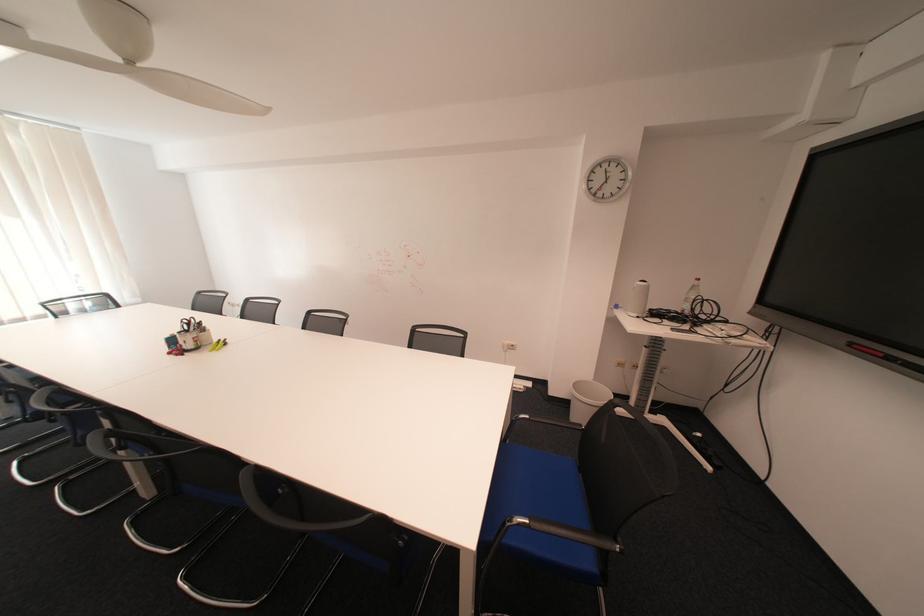
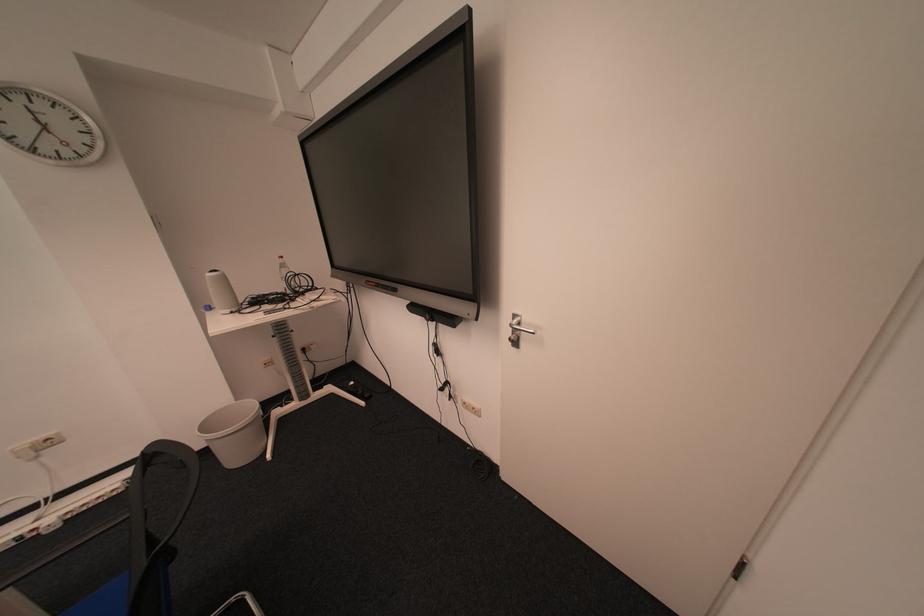
In the second image, find the point that corresponds to the point at 588,387 in the first image.

(216, 426)